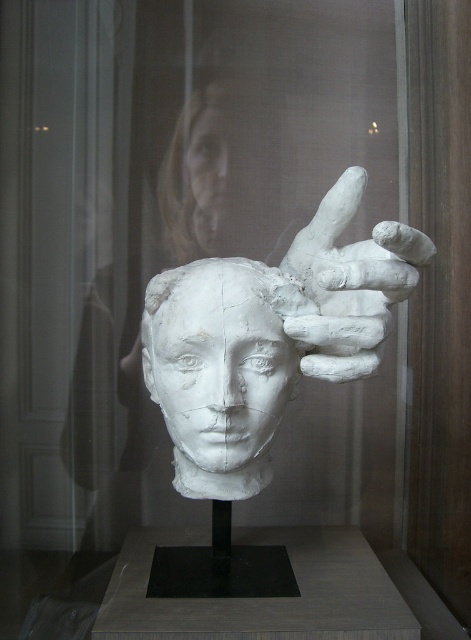
Question: Is white clay face at center to the left of smooth skin face at upper center from the viewer's perspective?

Choices:
 (A) yes
 (B) no

Answer: (B)

Question: Is white clay hand at upper center further to the viewer compared to smooth skin face at upper center?

Choices:
 (A) yes
 (B) no

Answer: (B)

Question: Which object is closer to the camera taking this photo?

Choices:
 (A) smooth skin face at upper center
 (B) white clay face at center

Answer: (B)

Question: Which object appears farthest from the camera in this image?

Choices:
 (A) white clay face at center
 (B) white clay head at upper center
 (C) white clay hand at upper center
 (D) smooth skin face at upper center

Answer: (D)

Question: Can you confirm if white clay face at center is thinner than white clay hand at upper center?

Choices:
 (A) no
 (B) yes

Answer: (A)

Question: Which object appears farthest from the camera in this image?

Choices:
 (A) white clay hand at upper center
 (B) white clay face at center
 (C) smooth skin face at upper center

Answer: (C)